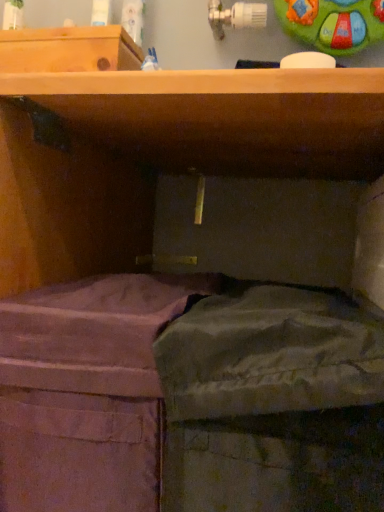
Question: From the image's perspective, is green crumpled paper at lower right, the first wide in the right-to-left sequence, located above or below pink fabric at lower left, which is the 1th wide from left to right?

Choices:
 (A) below
 (B) above

Answer: (B)

Question: Looking at their shapes, would you say green crumpled paper at lower right, which is the 2th wide in left-to-right order, is wider or thinner than pink fabric at lower left, which is the 1th wide from left to right?

Choices:
 (A) wide
 (B) thin

Answer: (A)

Question: Do you think green crumpled paper at lower right, which is the 2th wide in left-to-right order, is within pink fabric at lower left, the 2th wide viewed from the right, or outside of it?

Choices:
 (A) outside
 (B) inside

Answer: (A)

Question: Is point (81, 393) closer or farther from the camera than point (228, 430)?

Choices:
 (A) farther
 (B) closer

Answer: (A)

Question: Is pink fabric at lower left, the 2th wide viewed from the right, in front of or behind green crumpled paper at lower right, the first wide in the right-to-left sequence, in the image?

Choices:
 (A) front
 (B) behind

Answer: (B)

Question: Considering the positions of pink fabric at lower left, which is the 1th wide from left to right, and green crumpled paper at lower right, the first wide in the right-to-left sequence, in the image, is pink fabric at lower left, which is the 1th wide from left to right, wider or thinner than green crumpled paper at lower right, the first wide in the right-to-left sequence,?

Choices:
 (A) wide
 (B) thin

Answer: (B)

Question: In terms of height, does pink fabric at lower left, the 2th wide viewed from the right, look taller or shorter compared to green crumpled paper at lower right, which is the 2th wide in left-to-right order?

Choices:
 (A) tall
 (B) short

Answer: (A)